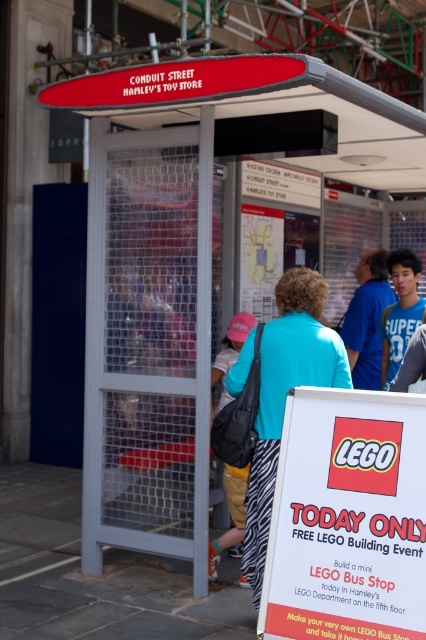
Measure the distance between point (235, 74) and camera.

Point (235, 74) is 4.36 meters away from camera.

Is the position of red plastic sign at upper center less distant than that of blue t-shirt at center?

Yes, red plastic sign at upper center is in front of blue t-shirt at center.

Between point (120, 81) and point (360, 333), which one is positioned in front?

Point (120, 81)

This screenshot has height=640, width=426. Identify the location of red plastic sign at upper center. (175, 81).

Is white paper sign at center positioned in front of light blue fabric shirt at center?

Yes, it is.

Is white paper sign at center behind light blue fabric shirt at center?

No, it is not.

Is point (336, 442) in front of point (224, 353)?

Yes.

You are a GUI agent. You are given a task and a screenshot of the screen. Output one action in this format:
    pyautogui.click(x=<x>, y=<y>)
    Task: Click on the white paper sign at center
    
    Given the screenshot: What is the action you would take?
    pyautogui.click(x=348, y=518)

Based on the photo, is blue t-shirt at center further to the viewer compared to blue cotton shirt at center?

Yes.

Is point (365, 381) positioned behind point (399, 298)?

Yes, it is behind point (399, 298).

Is point (357, 346) more distant than point (399, 289)?

That is True.

I want to click on blue t-shirt at center, so click(367, 320).